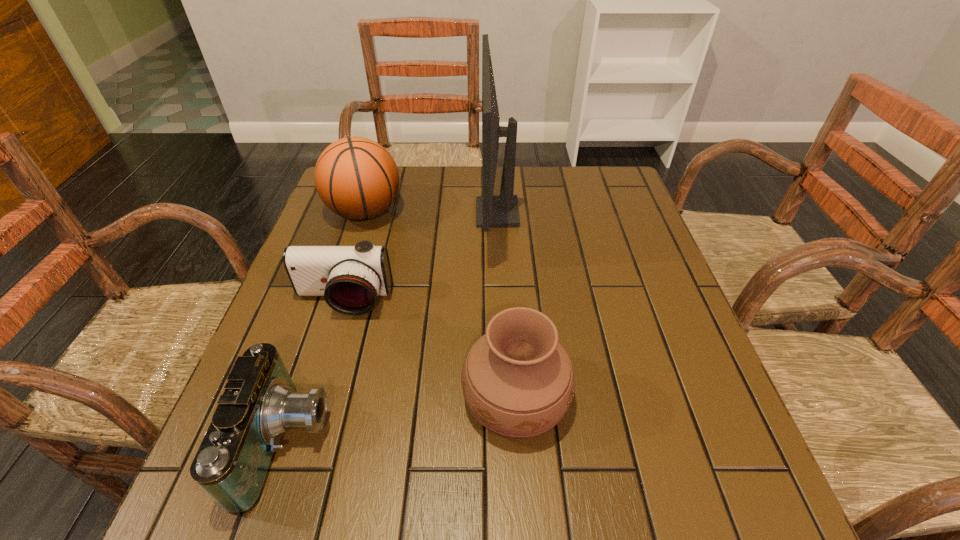
Where is `computer monitor`? Image resolution: width=960 pixels, height=540 pixels. computer monitor is located at coordinates (502, 211).

Where is `basketball`? Image resolution: width=960 pixels, height=540 pixels. basketball is located at coordinates (x=356, y=178).

Find the location of a particular element. urn is located at coordinates (517, 380).

The height and width of the screenshot is (540, 960). In order to click on the nearer camcorder in this screenshot , I will do `click(260, 403)`.

Where is `the farther camcorder`? the farther camcorder is located at coordinates (350, 278).

Where is `free space located 0.140m on the front-facing side of the tallest object`? free space located 0.140m on the front-facing side of the tallest object is located at coordinates (426, 213).

Image resolution: width=960 pixels, height=540 pixels. In order to click on vacant space situated 0.380m on the front-facing side of the tallest object in this screenshot , I will do `click(341, 213)`.

You are a GUI agent. You are given a task and a screenshot of the screen. Output one action in this format:
    pyautogui.click(x=<x>, y=<y>)
    Task: Click on the free space located on the front-facing side of the tallest object
    The width and height of the screenshot is (960, 540).
    Given the screenshot: What is the action you would take?
    pyautogui.click(x=348, y=213)

At what (x,y) coordinates should I click in order to perform the action: click on vacant area located 0.240m on the right of the basketball. Please return your answer as a coordinate pair (x, y). The height and width of the screenshot is (540, 960). Looking at the image, I should click on (489, 212).

At what (x,y) coordinates should I click in order to perform the action: click on vacant region located 0.050m on the right of the urn. Please return your answer as a coordinate pair (x, y). Image resolution: width=960 pixels, height=540 pixels. Looking at the image, I should click on (596, 396).